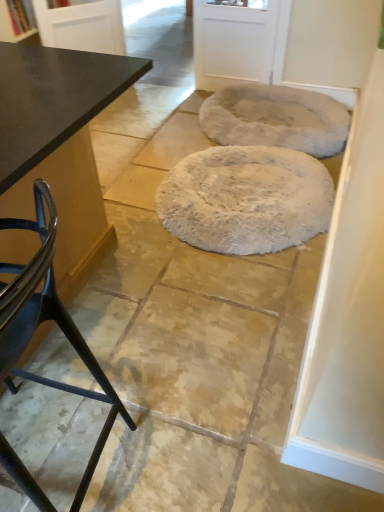
The image size is (384, 512). Find the location of `vacant area located to the right-hand side of matte black chair at left`. vacant area located to the right-hand side of matte black chair at left is located at coordinates (195, 429).